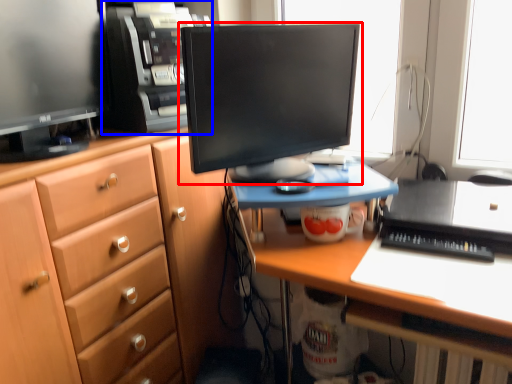
Question: Which of the following is the closest to the observer, computer monitor (highlighted by a red box) or computer tower (highlighted by a blue box)?

Choices:
 (A) computer monitor
 (B) computer tower

Answer: (A)